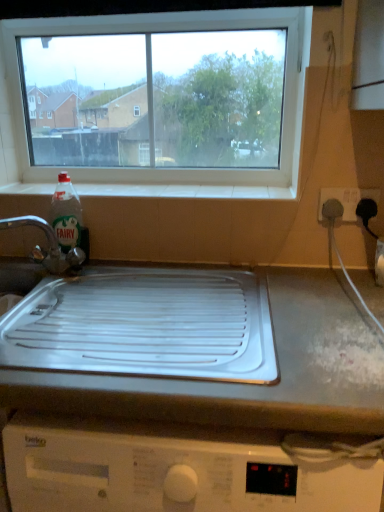
Identify the location of vacant area on top of white tile at upper center (from a real-world perspective). This screenshot has height=512, width=384. (197, 188).